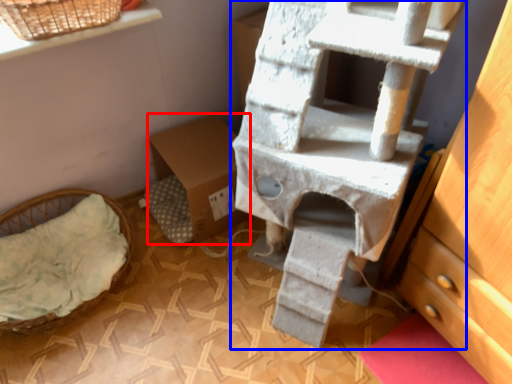
Question: Which point is further to the camera, cardboard box (highlighted by a red box) or bunk bed (highlighted by a blue box)?

Choices:
 (A) cardboard box
 (B) bunk bed

Answer: (A)